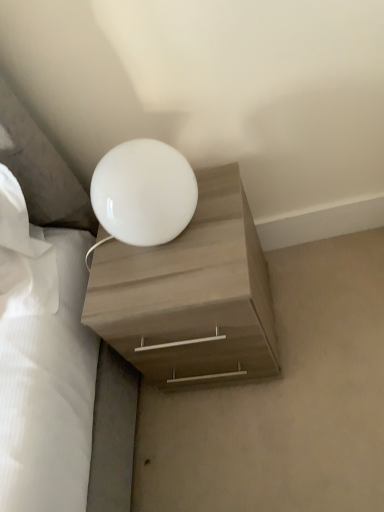
Where is `vacant area to the right of matte wood nightstand at center`? This screenshot has width=384, height=512. vacant area to the right of matte wood nightstand at center is located at coordinates (321, 297).